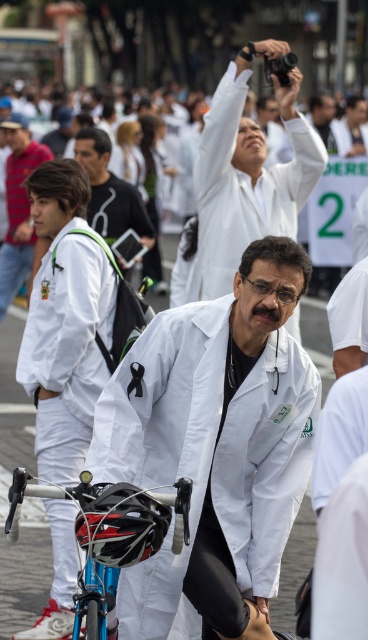
Question: Which point is farther from the camera taking this photo?

Choices:
 (A) (270, 260)
 (B) (69, 336)

Answer: (B)

Question: Which of the following is the farthest from the observer?

Choices:
 (A) matte white lab coat at left
 (B) white lab coat at center
 (C) white lab coat at upper center
 (D) black matte bicycle helmet at center

Answer: (A)

Question: Does black matte bicycle helmet at center appear over white lab coat at center?

Choices:
 (A) yes
 (B) no

Answer: (B)

Question: Does white matte jacket at left have a lesser width compared to matte white lab coat at left?

Choices:
 (A) no
 (B) yes

Answer: (A)

Question: Can you confirm if white matte lab coat at center is positioned to the right of black matte bicycle helmet at center?

Choices:
 (A) yes
 (B) no

Answer: (A)

Question: Considering the real-world distances, which object is closest to the white lab coat at upper center?

Choices:
 (A) black matte bicycle helmet at center
 (B) matte white lab coat at left
 (C) shiny blue bicycle at center
 (D) white matte lab coat at center

Answer: (D)